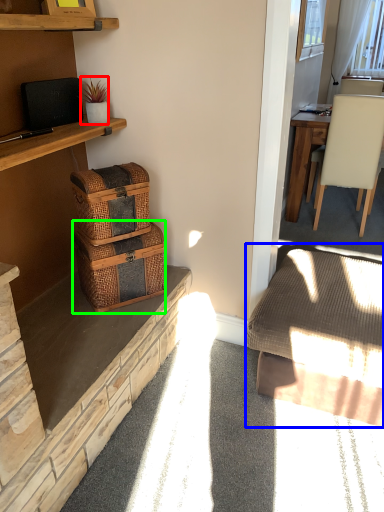
Question: Which is farther away from houseplant (highlighted by a red box)? studio couch (highlighted by a blue box) or picnic basket (highlighted by a green box)?

Choices:
 (A) studio couch
 (B) picnic basket

Answer: (A)